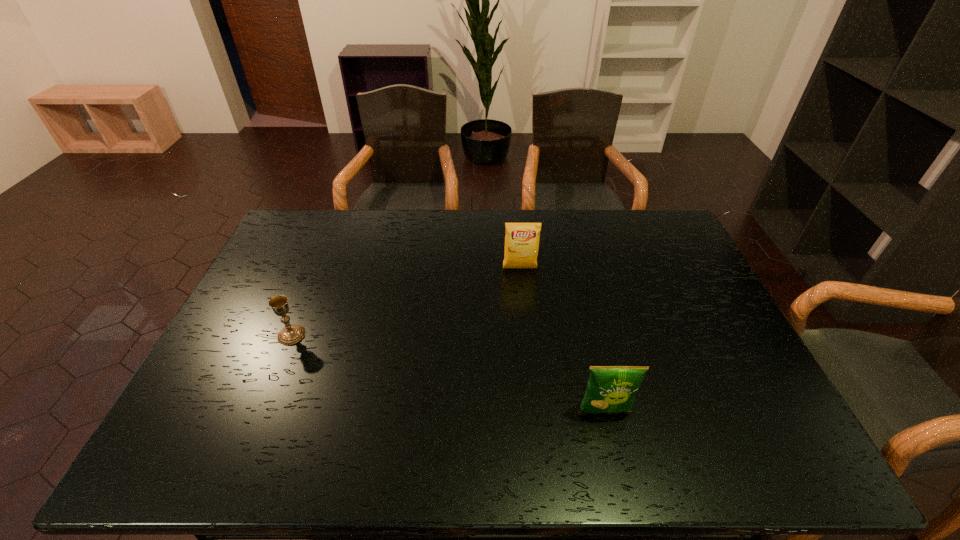
This screenshot has width=960, height=540. In order to click on the farthest object in this screenshot , I will do `click(522, 239)`.

In order to click on the left crisp (potato chip) in this screenshot , I will do `click(522, 239)`.

This screenshot has width=960, height=540. I want to click on the rightmost object, so click(610, 388).

The height and width of the screenshot is (540, 960). I want to click on the right crisp (potato chip), so click(x=610, y=388).

Identify the location of the shortest object. The image size is (960, 540). (291, 334).

Where is `the second nearest object`? This screenshot has width=960, height=540. the second nearest object is located at coordinates (291, 334).

At what (x,y) coordinates should I click in order to perform the action: click on blank space located 0.400m on the front of the second object from right to left with the logo. Please return your answer as a coordinate pair (x, y). This screenshot has height=540, width=960. Looking at the image, I should click on (531, 373).

Identify the location of vacant region located on the front-facing side of the nearer crisp (potato chip). (612, 444).

The width and height of the screenshot is (960, 540). I want to click on vacant area located on the left of the second nearest object, so click(x=256, y=335).

Locate an element on the screen. The width and height of the screenshot is (960, 540). object that is positioned at the left edge is located at coordinates (291, 334).